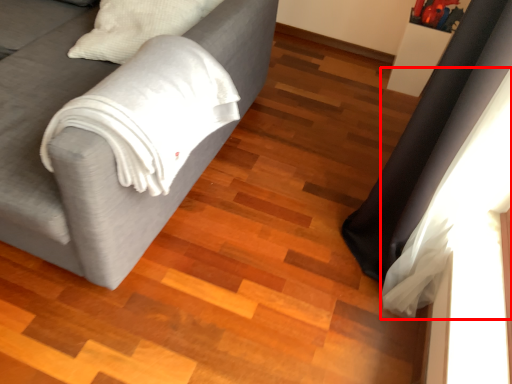
Question: From the image's perspective, what is the correct spatial positioning of curtain (annotated by the red box) in reference to studio couch?

Choices:
 (A) below
 (B) above

Answer: (A)